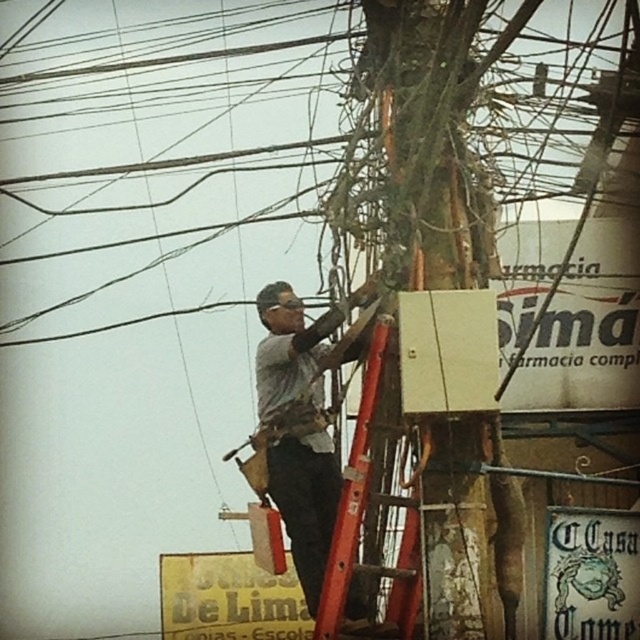
Question: Considering the real-world distances, which object is farthest from the red metal ladder at center?

Choices:
 (A) gray fabric construction worker at center
 (B) green mossy tree trunk at center

Answer: (A)

Question: Which of these objects is positioned farthest from the green mossy tree trunk at center?

Choices:
 (A) gray fabric construction worker at center
 (B) red metal ladder at center

Answer: (A)

Question: Does gray fabric construction worker at center appear under red metal ladder at center?

Choices:
 (A) no
 (B) yes

Answer: (A)

Question: Is green mossy tree trunk at center below gray fabric construction worker at center?

Choices:
 (A) yes
 (B) no

Answer: (B)

Question: Is green mossy tree trunk at center positioned behind gray fabric construction worker at center?

Choices:
 (A) yes
 (B) no

Answer: (B)

Question: Estimate the real-world distances between objects in this image. Which object is farther from the green mossy tree trunk at center?

Choices:
 (A) red metal ladder at center
 (B) gray fabric construction worker at center

Answer: (B)